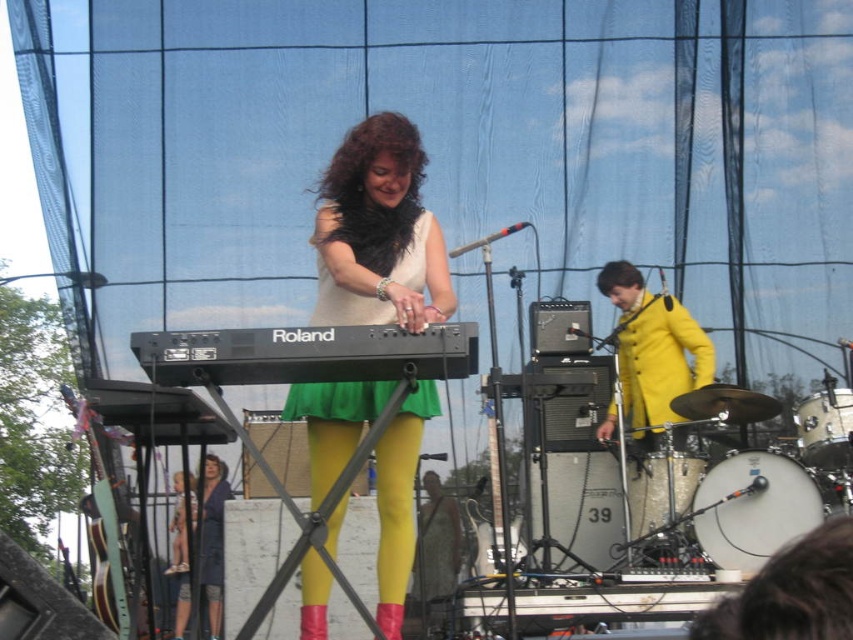
Does black matte keyboard at center have a larger size compared to green glossy guitar at left?

Indeed, black matte keyboard at center has a larger size compared to green glossy guitar at left.

Can you confirm if black matte keyboard at center is positioned to the right of green glossy guitar at left?

Indeed, black matte keyboard at center is positioned on the right side of green glossy guitar at left.

The image size is (853, 640). What do you see at coordinates (305, 355) in the screenshot? I see `black matte keyboard at center` at bounding box center [305, 355].

Identify the location of black matte keyboard at center. The height and width of the screenshot is (640, 853). (305, 355).

Is green glossy guitar at left smaller than matte blue dress at lower left?

No, green glossy guitar at left is not smaller than matte blue dress at lower left.

Is point (70, 388) less distant than point (218, 467)?

No.

This screenshot has height=640, width=853. Identify the location of green glossy guitar at left. (102, 522).

Is yellow fabric skirt at center wider than green glossy guitar at left?

Correct, the width of yellow fabric skirt at center exceeds that of green glossy guitar at left.

Is yellow fabric skirt at center bigger than green glossy guitar at left?

Yes, yellow fabric skirt at center is bigger than green glossy guitar at left.

Is point (339, 512) farther from camera compared to point (70, 394)?

No, (339, 512) is closer to viewer.

This screenshot has height=640, width=853. In order to click on yellow fabric skirt at center in this screenshot , I will do `click(395, 513)`.